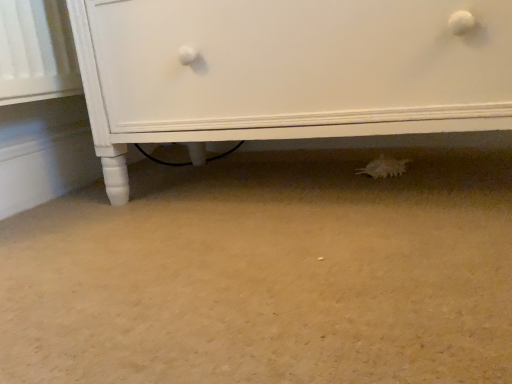
Identify the location of white painted wood chest of drawers at center. The height and width of the screenshot is (384, 512). (286, 71).

Describe the element at coordinates (286, 71) in the screenshot. The height and width of the screenshot is (384, 512). I see `white painted wood chest of drawers at center` at that location.

Find the location of a particular element. The height and width of the screenshot is (384, 512). white painted wood chest of drawers at center is located at coordinates (286, 71).